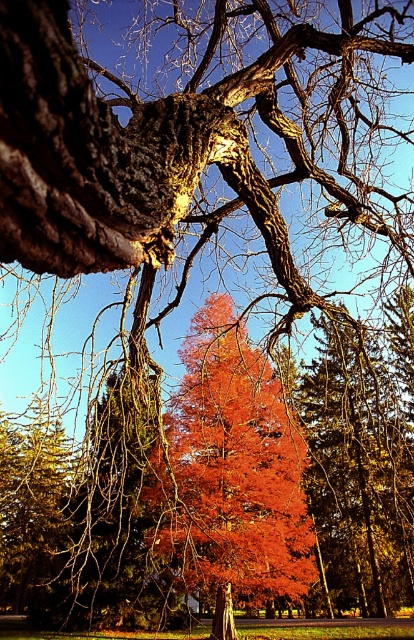
Can you confirm if vivid orange leaves at center is taller than smooth bark tree trunk at center?

Indeed, vivid orange leaves at center has a greater height compared to smooth bark tree trunk at center.

Who is higher up, vivid orange leaves at center or smooth bark tree trunk at center?

Positioned higher is vivid orange leaves at center.

The height and width of the screenshot is (640, 414). What do you see at coordinates (231, 468) in the screenshot? I see `vivid orange leaves at center` at bounding box center [231, 468].

You are a GUI agent. You are given a task and a screenshot of the screen. Output one action in this format:
    pyautogui.click(x=<x>, y=<y>)
    Task: Click on the vivid orange leaves at center
    The width and height of the screenshot is (414, 640).
    Given the screenshot: What is the action you would take?
    pyautogui.click(x=231, y=468)